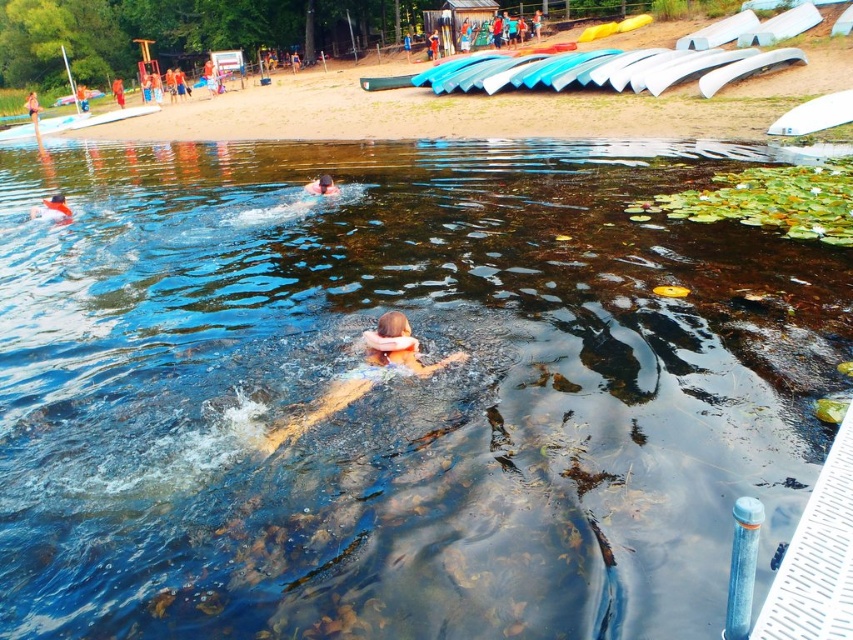
Question: Based on their relative distances, which object is nearer to the pink foam at center?

Choices:
 (A) orange fabric person at center
 (B) matte orange swim cap at lower center

Answer: (B)

Question: Which of the following is the farthest from the observer?

Choices:
 (A) orange fabric person at center
 (B) pink foam at center

Answer: (A)

Question: Which point is farther from the camera taking this photo?

Choices:
 (A) (318, 188)
 (B) (67, 205)

Answer: (A)

Question: Is matte orange swim cap at lower center closer to the viewer compared to pink foam at center?

Choices:
 (A) no
 (B) yes

Answer: (B)

Question: Does matte orange swim cap at lower center appear over orange fabric person at center?

Choices:
 (A) yes
 (B) no

Answer: (B)

Question: Does matte orange swim cap at lower center have a smaller size compared to pink foam at center?

Choices:
 (A) yes
 (B) no

Answer: (B)